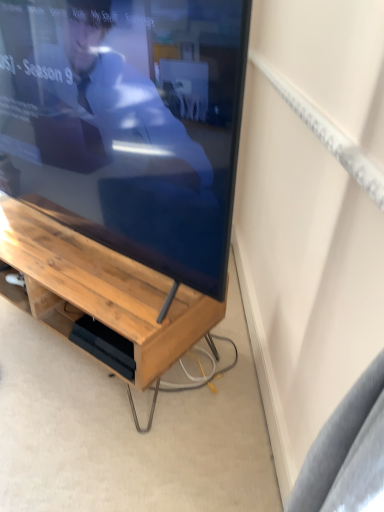
At what (x,y) coordinates should I click in order to perform the action: click on vacant space underneath matte wood tv at center (from a real-world perspective). Please return your answer as a coordinate pair (x, y). The height and width of the screenshot is (512, 384). Looking at the image, I should click on (89, 259).